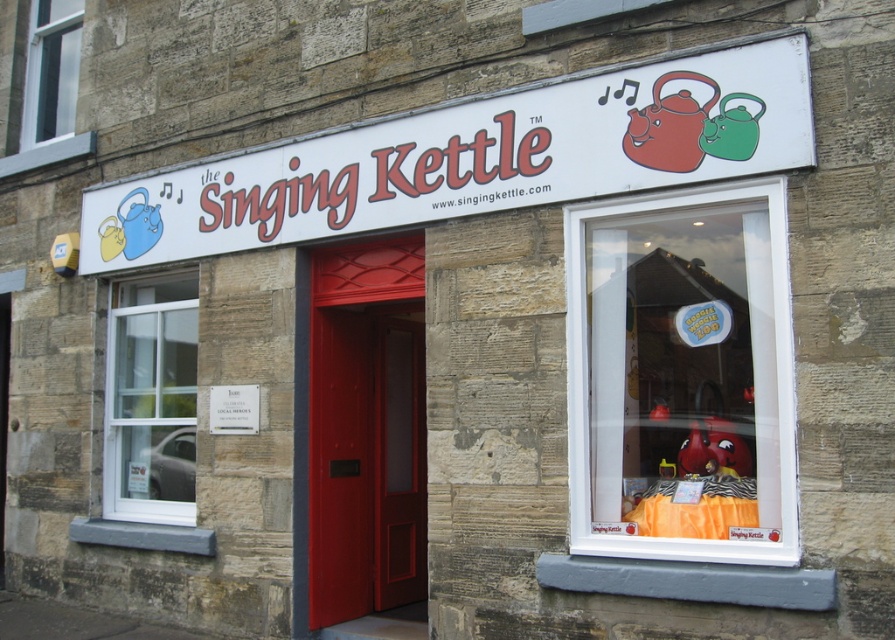
This screenshot has height=640, width=895. What do you see at coordinates (130, 227) in the screenshot?
I see `blue rubber tea pot at upper left` at bounding box center [130, 227].

Between point (129, 202) and point (723, 141), which one is positioned behind?

Point (129, 202)

This screenshot has width=895, height=640. In order to click on blue rubber tea pot at upper left in this screenshot , I will do `click(130, 227)`.

Is white plastic sign at upper center closer to camera compared to matte red teapot at upper center?

Yes, it is.

Does point (354, 172) come in front of point (685, 132)?

No.

This screenshot has width=895, height=640. What do you see at coordinates (476, 156) in the screenshot? I see `white plastic sign at upper center` at bounding box center [476, 156].

The image size is (895, 640). In order to click on white plastic sign at upper center in this screenshot , I will do `click(476, 156)`.

Is matte plastic kettle at center bigger than white plastic window at upper left?

Correct, matte plastic kettle at center is larger in size than white plastic window at upper left.

What do you see at coordinates (680, 376) in the screenshot? Image resolution: width=895 pixels, height=640 pixels. I see `matte plastic kettle at center` at bounding box center [680, 376].

Find the location of a particular element. matte plastic kettle at center is located at coordinates (680, 376).